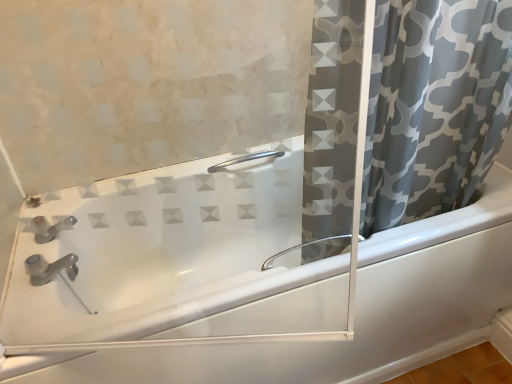
Question: Is the depth of satin nickel faucet at upper left greater than that of gray printed fabric curtain at right?

Choices:
 (A) yes
 (B) no

Answer: (A)

Question: Is satin nickel faucet at upper left to the right of gray printed fabric curtain at right from the viewer's perspective?

Choices:
 (A) no
 (B) yes

Answer: (A)

Question: Considering the relative sizes of satin nickel faucet at upper left and gray printed fabric curtain at right in the image provided, is satin nickel faucet at upper left bigger than gray printed fabric curtain at right?

Choices:
 (A) no
 (B) yes

Answer: (A)

Question: Considering the relative sizes of satin nickel faucet at upper left and gray printed fabric curtain at right in the image provided, is satin nickel faucet at upper left smaller than gray printed fabric curtain at right?

Choices:
 (A) yes
 (B) no

Answer: (A)

Question: Can you confirm if satin nickel faucet at upper left is wider than gray printed fabric curtain at right?

Choices:
 (A) no
 (B) yes

Answer: (A)

Question: Is satin nickel faucet at upper left not inside gray printed fabric curtain at right?

Choices:
 (A) yes
 (B) no

Answer: (A)

Question: Is white glossy bathtub at center touching gray printed fabric curtain at right?

Choices:
 (A) no
 (B) yes

Answer: (A)

Question: Is the depth of white glossy bathtub at center less than that of gray printed fabric curtain at right?

Choices:
 (A) yes
 (B) no

Answer: (B)

Question: Is white glossy bathtub at center positioned with its back to gray printed fabric curtain at right?

Choices:
 (A) yes
 (B) no

Answer: (B)

Question: Considering the relative sizes of white glossy bathtub at center and gray printed fabric curtain at right in the image provided, is white glossy bathtub at center bigger than gray printed fabric curtain at right?

Choices:
 (A) no
 (B) yes

Answer: (B)

Question: Is white glossy bathtub at center facing towards gray printed fabric curtain at right?

Choices:
 (A) no
 (B) yes

Answer: (A)

Question: From the image's perspective, does white glossy bathtub at center appear lower than gray printed fabric curtain at right?

Choices:
 (A) yes
 (B) no

Answer: (A)

Question: Considering the relative sizes of gray printed fabric curtain at right and satin nickel faucet at upper left in the image provided, is gray printed fabric curtain at right shorter than satin nickel faucet at upper left?

Choices:
 (A) yes
 (B) no

Answer: (B)